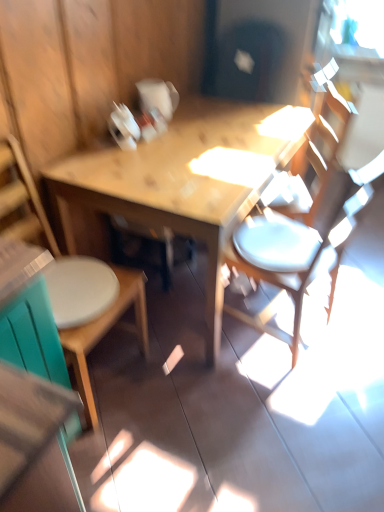
I want to click on vacant area that is in front of wooden table at center, so coord(247,415).